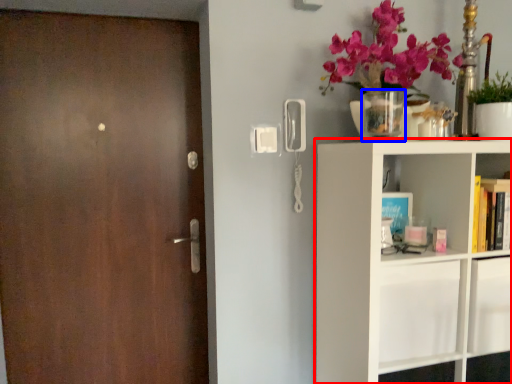
Question: Which of the following is the closest to the observer, shelf (highlighted by a red box) or vase (highlighted by a blue box)?

Choices:
 (A) shelf
 (B) vase

Answer: (A)